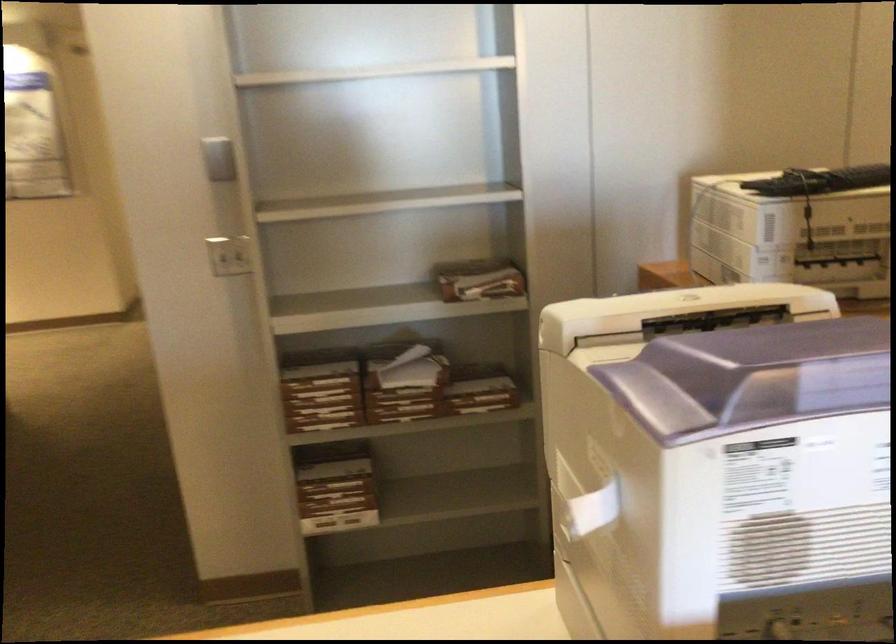
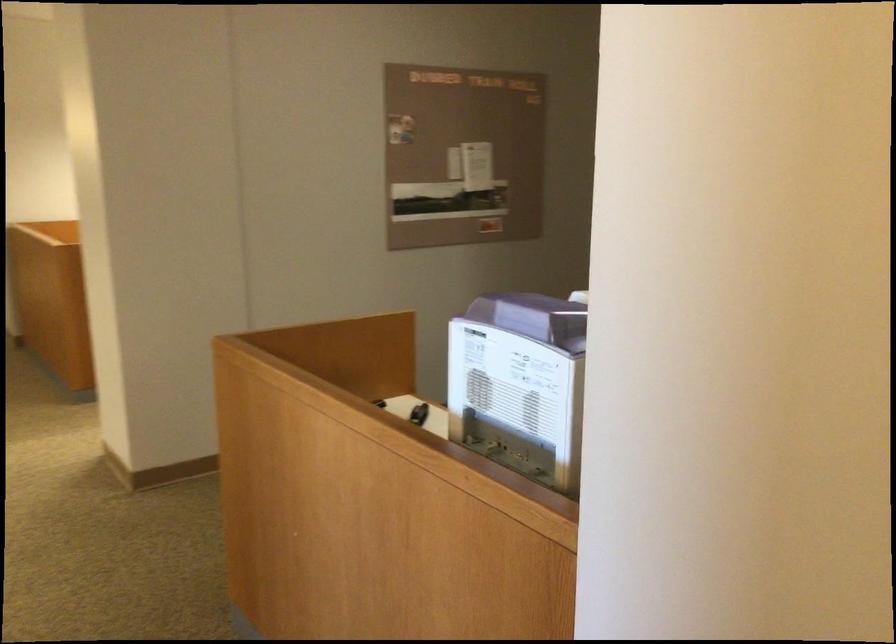
Question: I am providing you with two images of the same scene from different viewpoints. After the viewpoint changes to image2, which objects are now occluded?

Choices:
 (A) silver tape dispenser
 (B) stack of files
 (C) purple machine lid
 (D) small black object

Answer: (B)